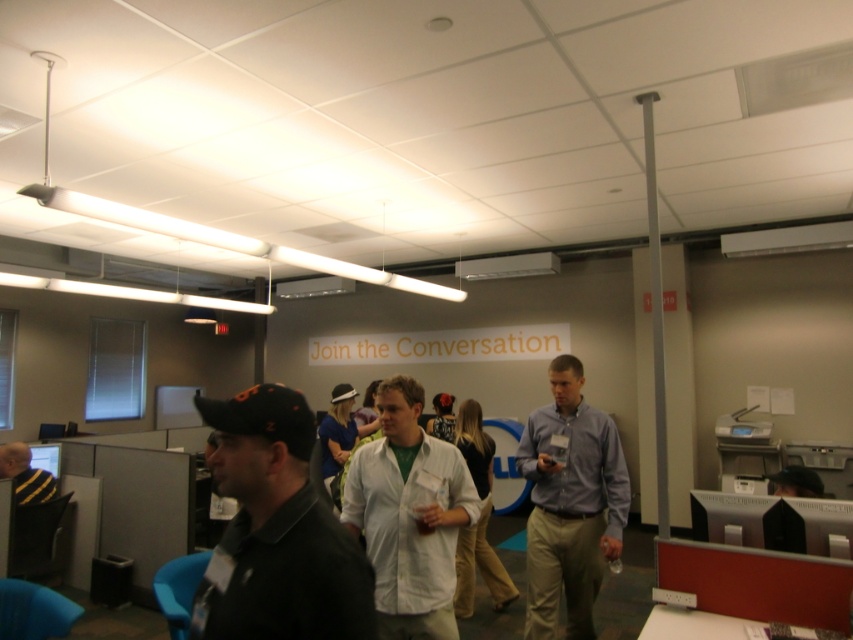
Find the location of a particular element. black matte cap at left is located at coordinates (276, 531).

Is point (287, 582) in front of point (12, 451)?

Yes, it is.

I want to click on black matte cap at left, so click(x=276, y=531).

Can you confirm if light blue shirt at center is wider than matte black cap at center?

Yes, light blue shirt at center is wider than matte black cap at center.

What do you see at coordinates (570, 502) in the screenshot? I see `light blue shirt at center` at bounding box center [570, 502].

Find the location of a particular element. This screenshot has height=640, width=853. light blue shirt at center is located at coordinates (570, 502).

Who is more distant from viewer, (465, 403) or (775, 490)?

Point (465, 403)

Can you confirm if white cotton shirt at center is bigger than matte black cap at upper center?

Correct, white cotton shirt at center is larger in size than matte black cap at upper center.

Locate an element on the screen. The height and width of the screenshot is (640, 853). white cotton shirt at center is located at coordinates (479, 518).